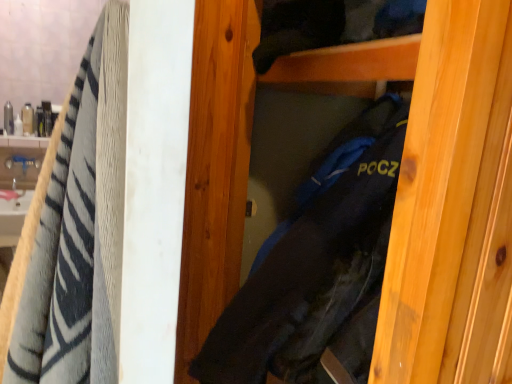
Question: Considering the positions of white glossy sink at left and black fabric bag at center in the image, is white glossy sink at left wider or thinner than black fabric bag at center?

Choices:
 (A) wide
 (B) thin

Answer: (B)

Question: In the image, is white glossy sink at left on the left side or the right side of black fabric bag at center?

Choices:
 (A) right
 (B) left

Answer: (B)

Question: Considering the real-world distances, which object is closest to the white glossy sink at left?

Choices:
 (A) black fabric bag at center
 (B) soft cotton towel at left

Answer: (A)

Question: Estimate the real-world distances between objects in this image. Which object is farther from the white glossy sink at left?

Choices:
 (A) soft cotton towel at left
 (B) black fabric bag at center

Answer: (A)